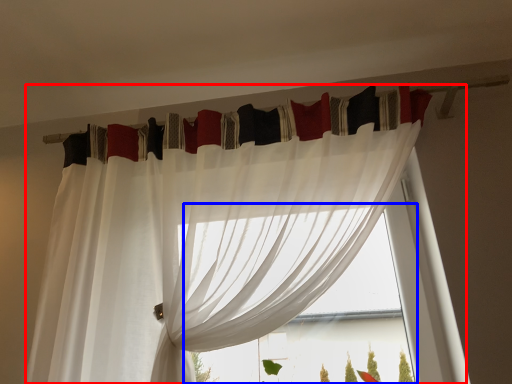
Question: Which object is closer to the camera taking this photo, curtain (highlighted by a red box) or bay window (highlighted by a blue box)?

Choices:
 (A) curtain
 (B) bay window

Answer: (A)